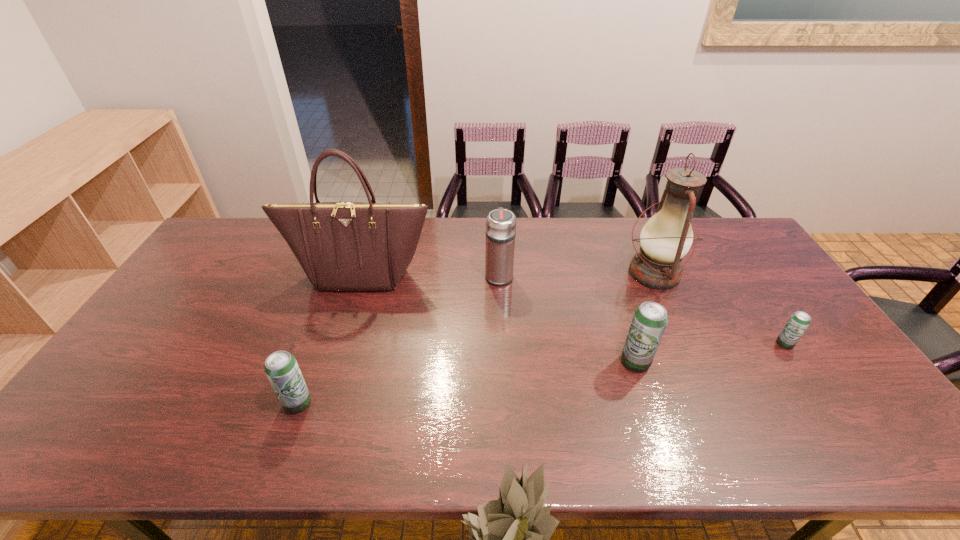
At what (x,y) coordinates should I click in order to perform the action: click on vacant space that's between the oil lamp and the shortest object. Please return your answer as a coordinate pair (x, y). Image resolution: width=960 pixels, height=540 pixels. Looking at the image, I should click on (719, 308).

Find the location of a particular element. The image size is (960, 540). free point between the shortest beer can and the handbag is located at coordinates pos(572,309).

Where is `empty location between the fourth object from left to right and the nearest object`? This screenshot has height=540, width=960. empty location between the fourth object from left to right and the nearest object is located at coordinates (467, 382).

Image resolution: width=960 pixels, height=540 pixels. Find the location of `empty location between the second shortest object and the third object from right to left`. empty location between the second shortest object and the third object from right to left is located at coordinates (467, 382).

The height and width of the screenshot is (540, 960). I want to click on the fourth closest object to the nearest beer can, so click(x=667, y=236).

Identify which object is located as the third nearest to the rightmost beer can. Please provide its 2D coordinates. Your answer should be formatted as a tuple, i.e. [(x, y)], where the tuple contains the x and y coordinates of a point satisfying the conditions above.

[(500, 232)]

Identify which beer can is the third nearest to the fifth object from left to right. Please provide its 2D coordinates. Your answer should be formatted as a tuple, i.e. [(x, y)], where the tuple contains the x and y coordinates of a point satisfying the conditions above.

[(281, 367)]

At what (x,y) coordinates should I click in order to perform the action: click on beer can object that ranks as the second closest to the fourth shortest object. Please return your answer as a coordinate pair (x, y). This screenshot has width=960, height=540. Looking at the image, I should click on (281, 367).

Where is `vacant region that satisfies the following two spatial constraints: 1. on the front-facing side of the second nearest object; 2. on the right side of the handbag`? vacant region that satisfies the following two spatial constraints: 1. on the front-facing side of the second nearest object; 2. on the right side of the handbag is located at coordinates (333, 362).

The image size is (960, 540). What are the coordinates of `free location that satisfies the following two spatial constraints: 1. with a handle on the side of the oil lamp; 2. on the right side of the third object from left to right` in the screenshot? It's located at (499, 273).